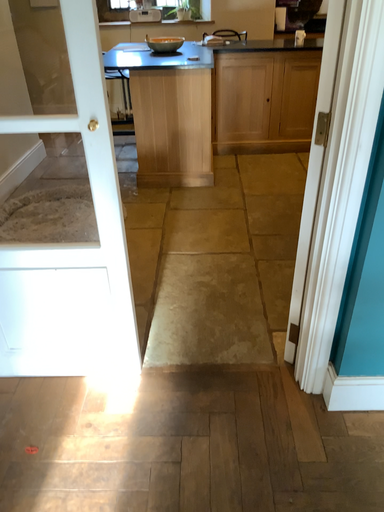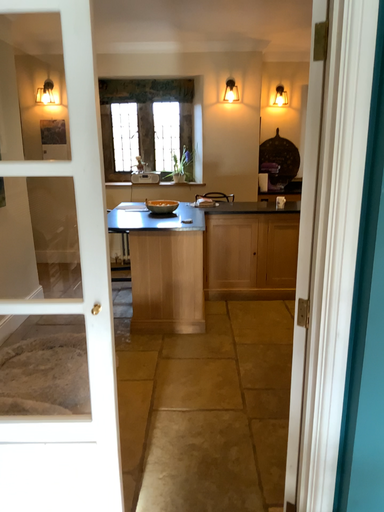
Question: How did the camera likely rotate when shooting the video?

Choices:
 (A) rotated upward
 (B) rotated downward

Answer: (A)